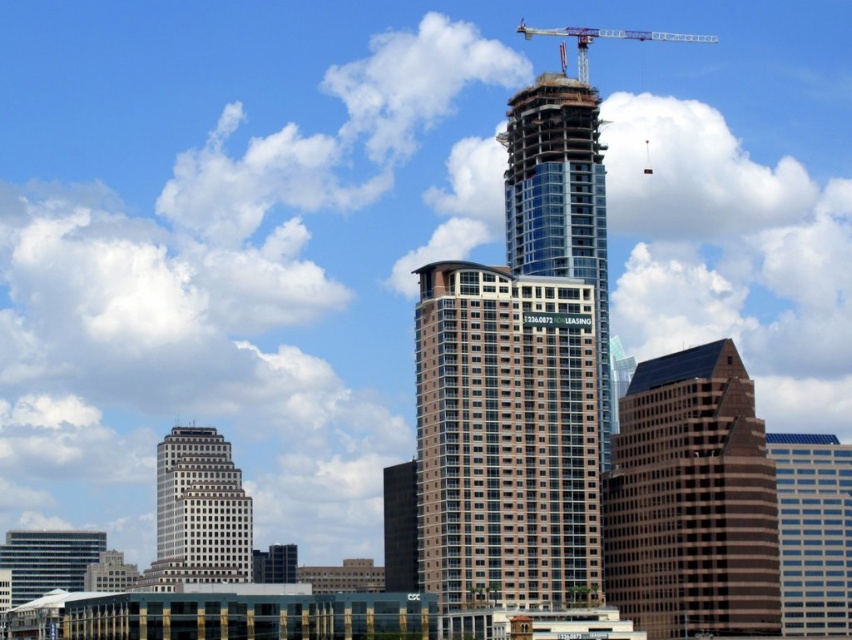
Looking at this image, you are standing on a pedestrian bridge that is 120 meters away from the base of the blue glass skyscraper at center. Can you safely walk closer to get a better view without entering restricted areas?

The blue glass skyscraper at center is 123.94 meters from the viewer. Since the pedestrian bridge is 120 meters away from the base of the skyscraper, you are already within a safe distance and can walk closer as long as you stay on the pedestrian bridge and avoid restricted areas.

You are an urban planner assessing the city layout. You need to determine if the blue glass skyscraper at center can be expanded to the right without interfering with the metallic silver crane at upper center. Based on their widths, can this expansion be feasible?

The blue glass skyscraper at center has a lesser width compared to the metallic silver crane at upper center. Therefore, expanding the blue glass skyscraper at center to the right may be possible as it is narrower than the crane, but further spatial analysis is needed to confirm clearance.